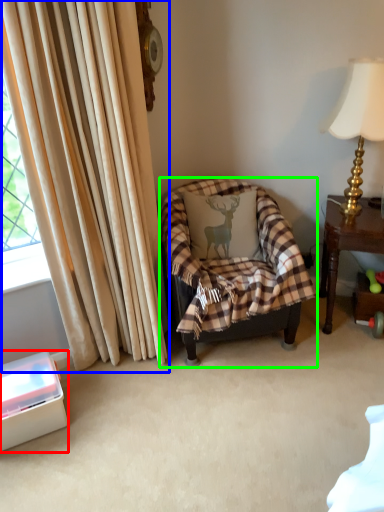
Question: Which object is positioned farthest from box (highlighted by a red box)? Select from curtain (highlighted by a blue box) and chair (highlighted by a green box).

Choices:
 (A) curtain
 (B) chair

Answer: (B)